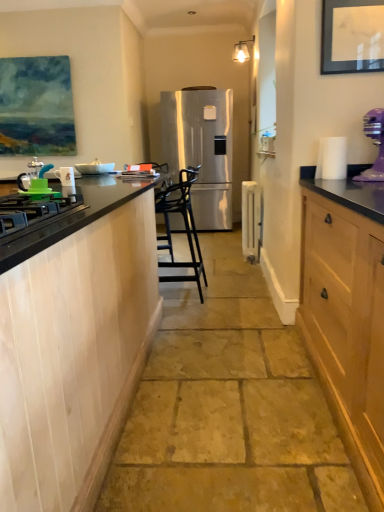
Question: From a real-world perspective, is satin silver refrigerator at center located beneath black matte gas stove at left?

Choices:
 (A) no
 (B) yes

Answer: (B)

Question: Does satin silver refrigerator at center have a lesser height compared to black matte gas stove at left?

Choices:
 (A) yes
 (B) no

Answer: (B)

Question: Does satin silver refrigerator at center have a larger size compared to black matte gas stove at left?

Choices:
 (A) yes
 (B) no

Answer: (A)

Question: Is satin silver refrigerator at center to the left of black matte gas stove at left from the viewer's perspective?

Choices:
 (A) no
 (B) yes

Answer: (A)

Question: From the image's perspective, is satin silver refrigerator at center on black matte gas stove at left?

Choices:
 (A) yes
 (B) no

Answer: (A)

Question: From the image's perspective, is white glossy mug at left, the second appliance viewed from the left, above or below white metallic radiator at center, the first appliance from the back?

Choices:
 (A) below
 (B) above

Answer: (B)

Question: Which is correct: white glossy mug at left, the second appliance viewed from the left, is inside white metallic radiator at center, positioned as the first appliance in right-to-left order, or outside of it?

Choices:
 (A) inside
 (B) outside

Answer: (B)

Question: In terms of height, does white glossy mug at left, which appears as the third appliance when viewed from the back, look taller or shorter compared to white metallic radiator at center, placed as the 4th appliance when sorted from front to back?

Choices:
 (A) tall
 (B) short

Answer: (B)

Question: Does point (72, 183) appear closer or farther from the camera than point (243, 182)?

Choices:
 (A) closer
 (B) farther

Answer: (A)

Question: From the image's perspective, is black metal bar stool at center positioned above or below black matte gas stove at left?

Choices:
 (A) below
 (B) above

Answer: (B)

Question: Based on their sizes in the image, would you say black metal bar stool at center is bigger or smaller than black matte gas stove at left?

Choices:
 (A) big
 (B) small

Answer: (A)

Question: Is black metal bar stool at center in front of or behind black matte gas stove at left in the image?

Choices:
 (A) behind
 (B) front

Answer: (A)

Question: In terms of width, does black metal bar stool at center look wider or thinner when compared to black matte gas stove at left?

Choices:
 (A) thin
 (B) wide

Answer: (B)

Question: Is point (33, 224) positioned closer to the camera than point (86, 168)?

Choices:
 (A) closer
 (B) farther

Answer: (A)

Question: Considering the positions of black matte gas stove at left and white glossy bowl at center, which appears as the 3th appliance when viewed from the front, in the image, is black matte gas stove at left taller or shorter than white glossy bowl at center, which appears as the 3th appliance when viewed from the front,?

Choices:
 (A) short
 (B) tall

Answer: (A)